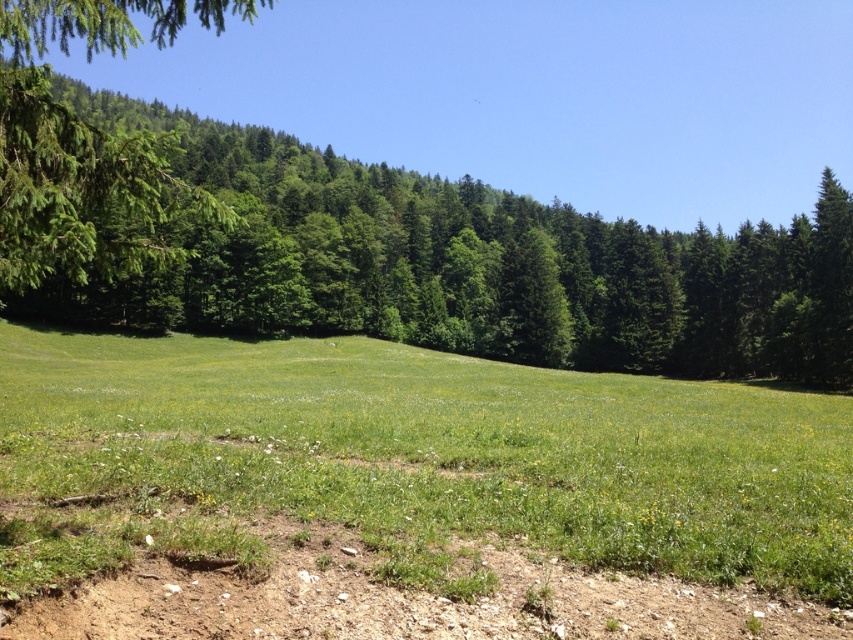
Question: Does green leafy tree at upper left appear over green leafy tree at left?

Choices:
 (A) yes
 (B) no

Answer: (B)

Question: Does green leafy tree at upper left appear on the left side of brown dirt track at lower center?

Choices:
 (A) yes
 (B) no

Answer: (A)

Question: Which point is closer to the camera?

Choices:
 (A) green grassy field at center
 (B) brown dirt track at lower center
 (C) green leafy tree at left

Answer: (A)

Question: Which object is closer to the camera taking this photo?

Choices:
 (A) green leafy tree at left
 (B) brown dirt track at lower center

Answer: (B)

Question: Which point is closer to the camera?

Choices:
 (A) green leafy tree at left
 (B) green leafy tree at upper left
 (C) brown dirt track at lower center
 (D) green grassy field at center

Answer: (D)

Question: Does green grassy field at center lie behind green leafy tree at upper left?

Choices:
 (A) no
 (B) yes

Answer: (A)